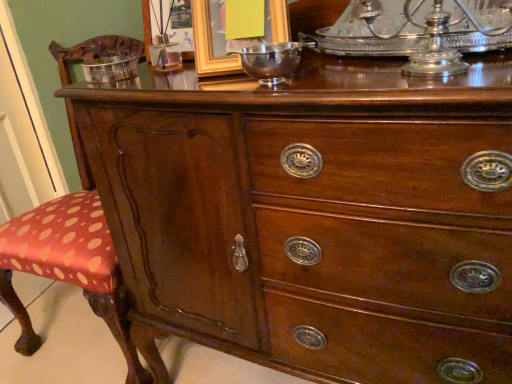
Image resolution: width=512 pixels, height=384 pixels. Find the location of `free spot to the right of silver metallic bowl at upper left`. free spot to the right of silver metallic bowl at upper left is located at coordinates tap(174, 75).